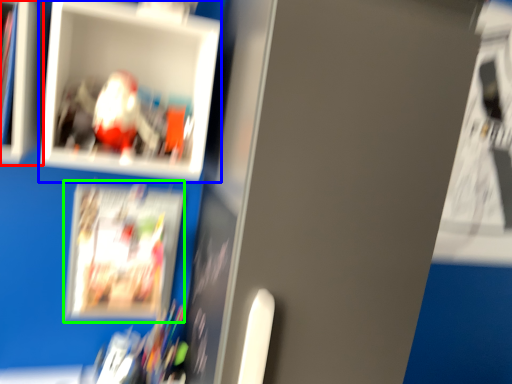
Question: Considering the real-world distances, which object is closest to cabinet (highlighted by a red box)? picture frame (highlighted by a blue box) or magazine (highlighted by a green box).

Choices:
 (A) picture frame
 (B) magazine

Answer: (A)